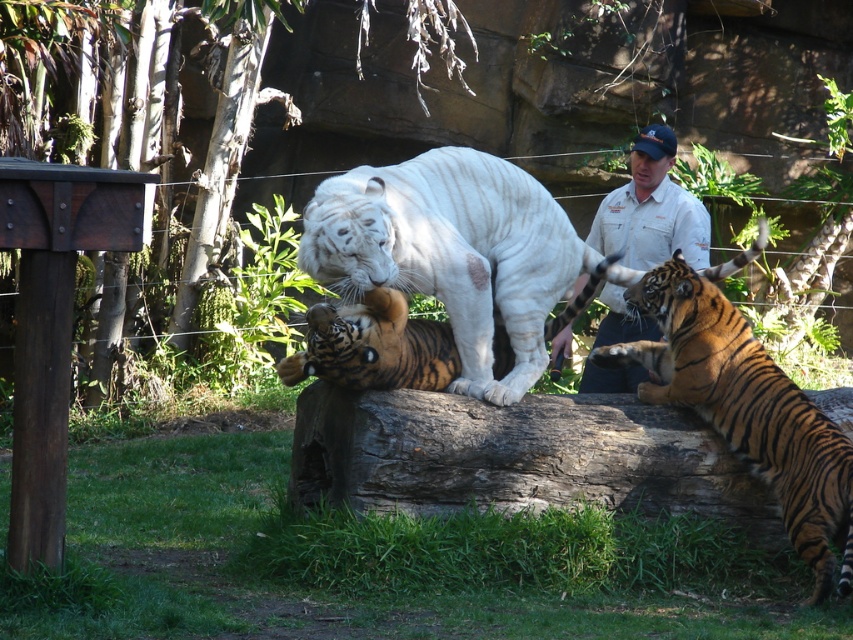
Is orange striped tiger at center further to the viewer compared to white shirt at upper center?

No, it is not.

Who is positioned more to the left, orange striped tiger at center or white shirt at upper center?

From the viewer's perspective, white shirt at upper center appears more on the left side.

Find the location of a particular element. orange striped tiger at center is located at coordinates (746, 408).

How far apart are white striped tiger at center and orange striped tiger at center?

A distance of 1.37 meters exists between white striped tiger at center and orange striped tiger at center.

Where is `white striped tiger at center`? The width and height of the screenshot is (853, 640). white striped tiger at center is located at coordinates (451, 252).

Is white striped tiger at center wider than white shirt at upper center?

Yes.

Is white striped tiger at center bigger than white shirt at upper center?

Yes.

The width and height of the screenshot is (853, 640). What do you see at coordinates (451, 252) in the screenshot?
I see `white striped tiger at center` at bounding box center [451, 252].

Where is `white striped tiger at center`? The image size is (853, 640). white striped tiger at center is located at coordinates (451, 252).